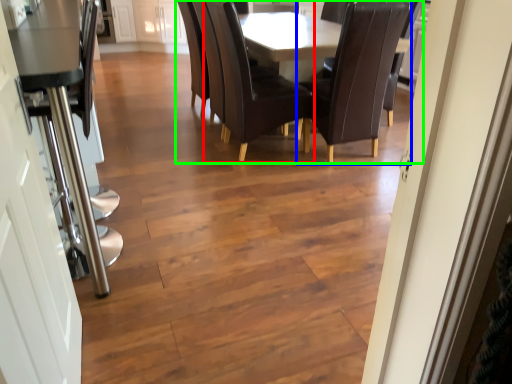
Question: Considering the real-world distances, which object is farthest from chair (highlighted by a red box)? chair (highlighted by a blue box) or kitchen & dining room table (highlighted by a green box)?

Choices:
 (A) chair
 (B) kitchen & dining room table

Answer: (A)